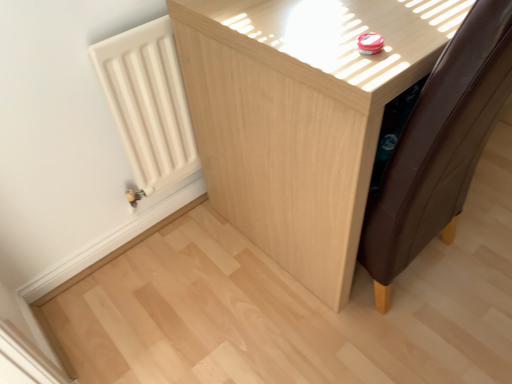
Question: Can you confirm if white matte radiator at left is wider than light wood cabinet at center?

Choices:
 (A) yes
 (B) no

Answer: (B)

Question: Can you confirm if white matte radiator at left is shorter than light wood cabinet at center?

Choices:
 (A) no
 (B) yes

Answer: (B)

Question: Is the position of white matte radiator at left more distant than that of light wood cabinet at center?

Choices:
 (A) no
 (B) yes

Answer: (B)

Question: Is white matte radiator at left turned away from light wood cabinet at center?

Choices:
 (A) yes
 (B) no

Answer: (B)

Question: Is white matte radiator at left completely or partially outside of light wood cabinet at center?

Choices:
 (A) no
 (B) yes

Answer: (B)

Question: From a real-world perspective, is white matte radiator at left under light wood cabinet at center?

Choices:
 (A) yes
 (B) no

Answer: (B)

Question: Considering the relative sizes of light wood cabinet at center and white matte radiator at left in the image provided, is light wood cabinet at center bigger than white matte radiator at left?

Choices:
 (A) no
 (B) yes

Answer: (B)

Question: Is light wood cabinet at center to the left of white matte radiator at left from the viewer's perspective?

Choices:
 (A) yes
 (B) no

Answer: (B)

Question: From the image's perspective, does light wood cabinet at center appear higher than white matte radiator at left?

Choices:
 (A) no
 (B) yes

Answer: (B)

Question: Is light wood cabinet at center next to white matte radiator at left?

Choices:
 (A) no
 (B) yes

Answer: (A)

Question: Considering the relative sizes of light wood cabinet at center and white matte radiator at left in the image provided, is light wood cabinet at center wider than white matte radiator at left?

Choices:
 (A) no
 (B) yes

Answer: (B)

Question: Does light wood cabinet at center have a lesser width compared to white matte radiator at left?

Choices:
 (A) yes
 (B) no

Answer: (B)

Question: Relative to white matte radiator at left, is light wood cabinet at center in front or behind?

Choices:
 (A) front
 (B) behind

Answer: (A)